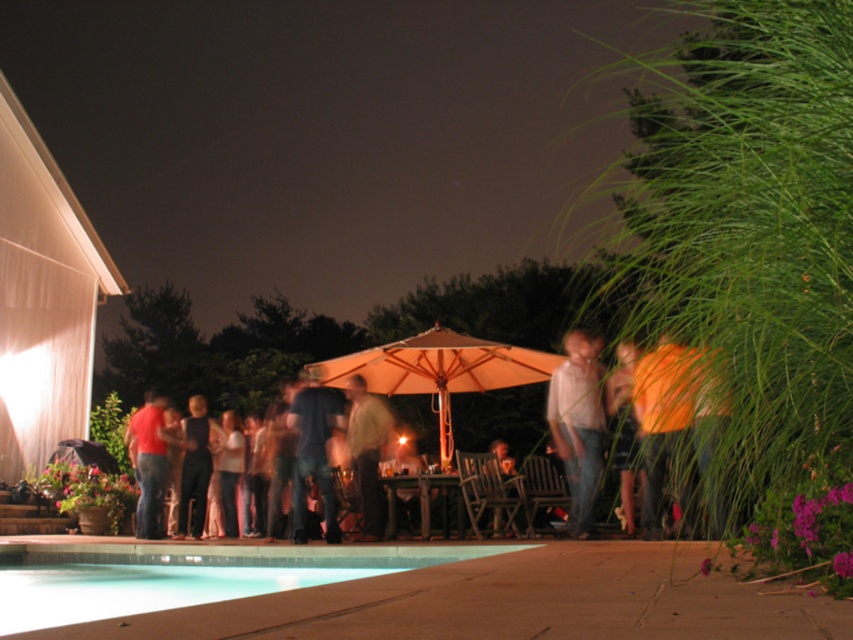
Does matte blue jeans at center have a greater height compared to denim jeans at center?

Yes, matte blue jeans at center is taller than denim jeans at center.

Which is more to the left, matte blue jeans at center or denim jeans at center?

denim jeans at center

Find the location of a particular element. The image size is (853, 640). matte blue jeans at center is located at coordinates (328, 452).

Consider the image. Which is more to the right, clear glass pool at lower center or denim jeans at center?

From the viewer's perspective, denim jeans at center appears more on the right side.

Does clear glass pool at lower center have a greater width compared to denim jeans at center?

Yes, clear glass pool at lower center is wider than denim jeans at center.

Who is more forward, (421, 560) or (306, 376)?

Point (421, 560) is more forward.

Where is `clear glass pool at lower center`? Image resolution: width=853 pixels, height=640 pixels. clear glass pool at lower center is located at coordinates (184, 573).

Which is more to the right, matte orange umbrella at center or matte blue jeans at center?

Positioned to the right is matte blue jeans at center.

Does point (196, 355) lie behind point (323, 433)?

That is True.

Is point (219, 356) positioned before point (374, 499)?

No.

What are the coordinates of `matte orange umbrella at center` in the screenshot? It's located at (218, 356).